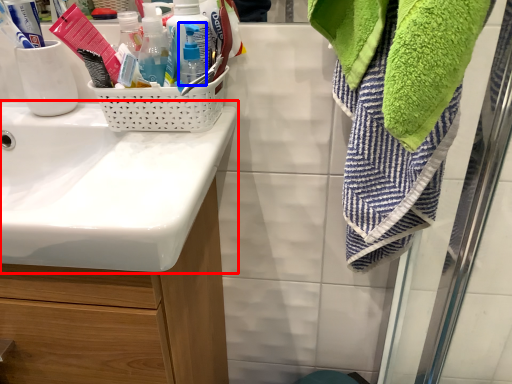
Question: Which object appears closest to the camera in this image, sink (highlighted by a red box) or bottle (highlighted by a blue box)?

Choices:
 (A) sink
 (B) bottle

Answer: (A)